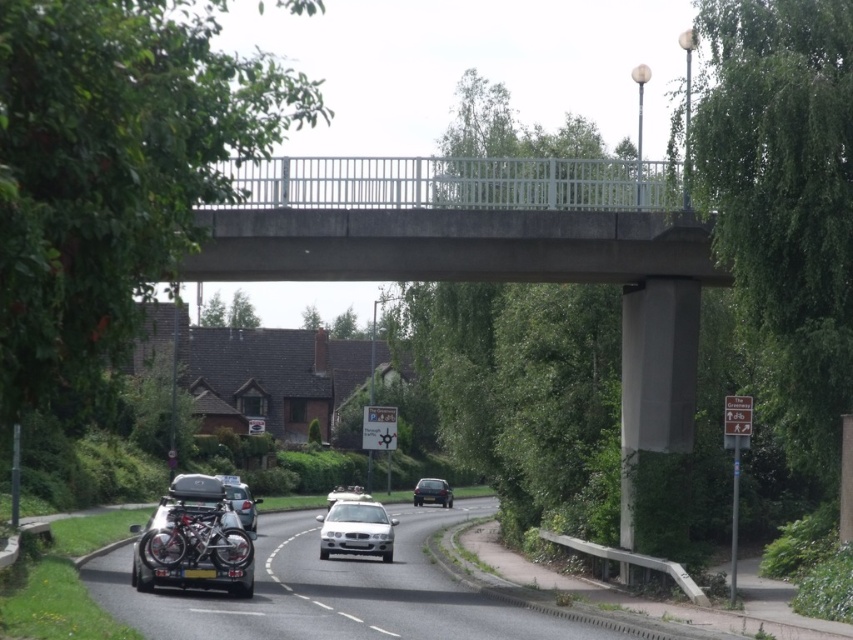
You are a driver approaching the bridge and need to read the license plates on the vehicles ahead. Which license plate, the black plastic license plate at center or the black plastic license plate at lower center, would you see as wider from your current position?

The black plastic license plate at center is wider than the black plastic license plate at lower center, so you would see the black plastic license plate at center as wider from your current position.

You are a delivery truck driver who needs to cross the concrete bridge at center. The truck is as wide as the black matte car at lower left. Can the truck safely pass over the bridge?

The concrete bridge at center has a lesser width compared to the black matte car at lower left. Since the truck is as wide as the car, the bridge is not wide enough to accommodate the truck safely. The driver should choose an alternate route.

In the rural road scene, where is the concrete bridge at center located in terms of its 2D coordinates?

The concrete bridge at center is located at the 2D coordinates of point (450,221).